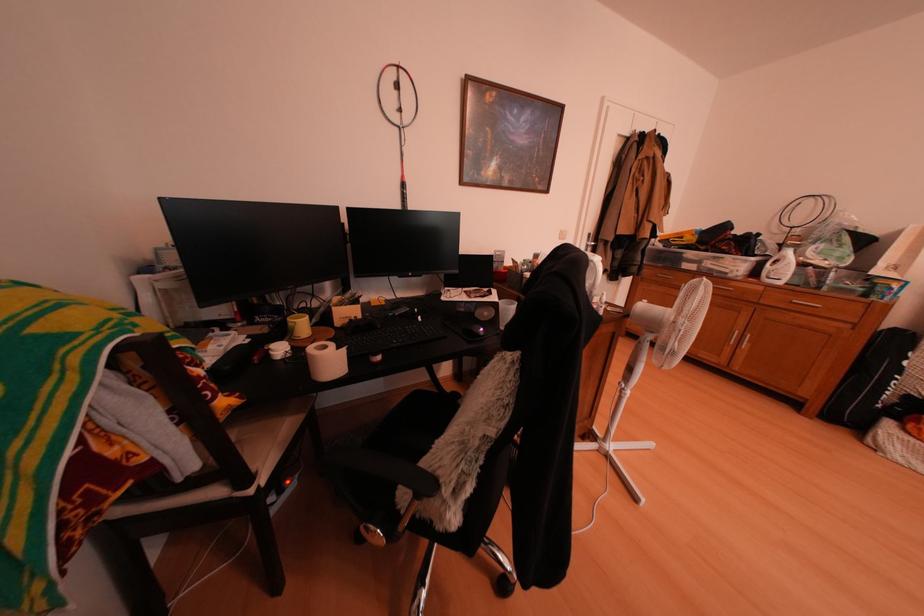
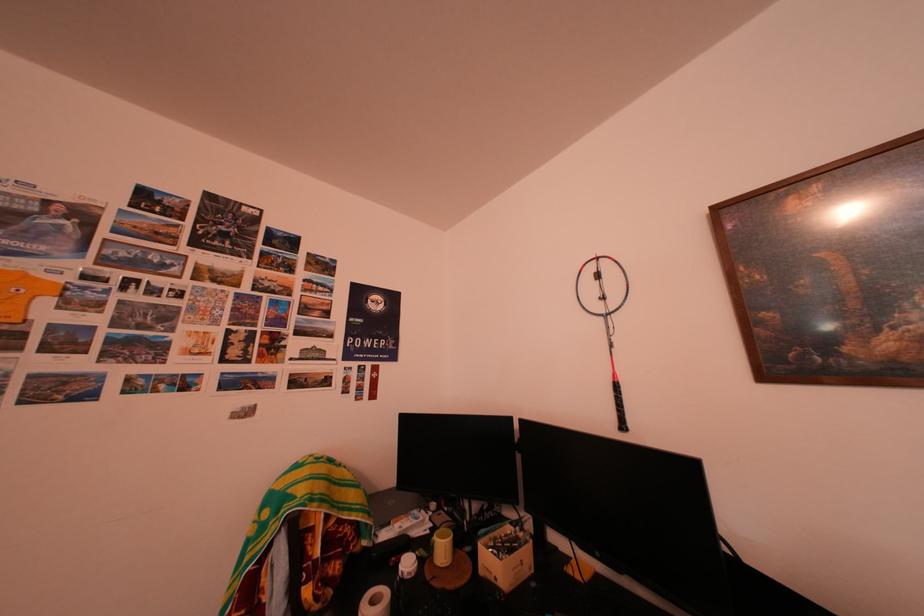
In the second image, find the point that corresponds to (261,345) in the first image.

(441, 537)